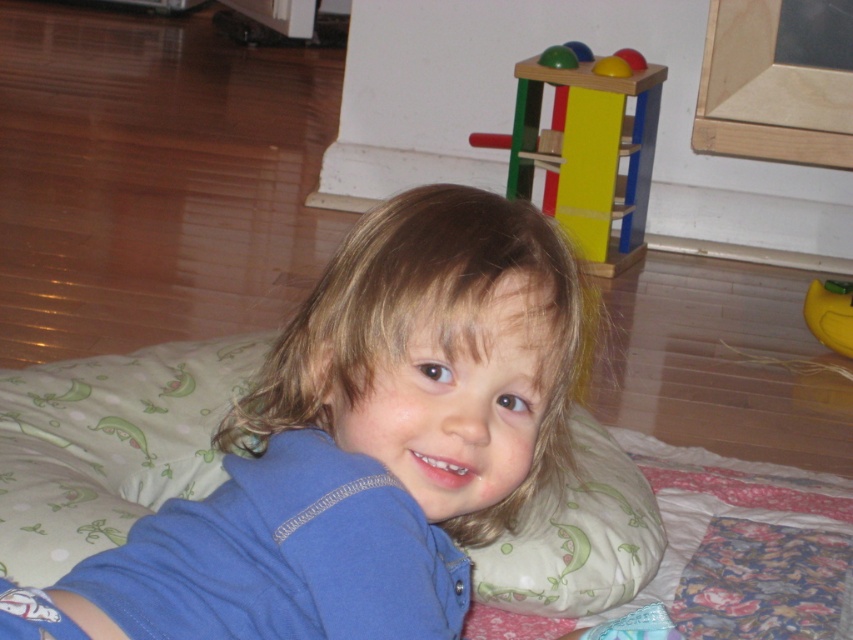
Can you confirm if wooden toy at upper right is positioned below green rubber ball at upper center?

Yes.

Is wooden toy at upper right bigger than green rubber ball at upper center?

Yes, wooden toy at upper right is bigger than green rubber ball at upper center.

Is point (511, 150) positioned behind point (561, 52)?

Yes, point (511, 150) is behind point (561, 52).

Image resolution: width=853 pixels, height=640 pixels. In order to click on wooden toy at upper right in this screenshot , I will do `click(585, 154)`.

Is blue cotton shirt at center positioned in front of green fabric pillow at lower center?

Yes.

Is blue cotton shirt at center above green fabric pillow at lower center?

Yes, blue cotton shirt at center is above green fabric pillow at lower center.

Between point (492, 429) and point (495, 556), which one is positioned behind?

Positioned behind is point (495, 556).

Identify the location of blue cotton shirt at center. This screenshot has width=853, height=640. (433, 356).

Can you confirm if blue cotton shirt at center is wider than yellow rubber duck at lower right?

Indeed, blue cotton shirt at center has a greater width compared to yellow rubber duck at lower right.

Does blue cotton shirt at center have a smaller size compared to yellow rubber duck at lower right?

No, blue cotton shirt at center is not smaller than yellow rubber duck at lower right.

At what (x,y) coordinates should I click in order to perform the action: click on blue cotton shirt at center. Please return your answer as a coordinate pair (x, y). The height and width of the screenshot is (640, 853). Looking at the image, I should click on (433, 356).